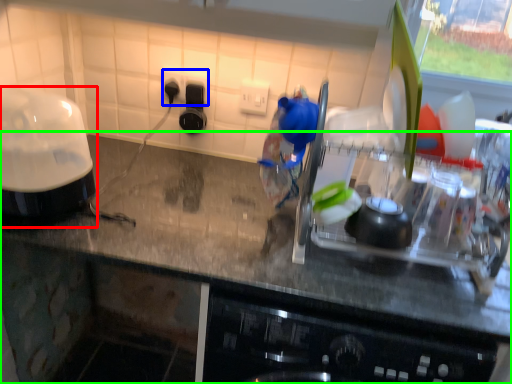
Question: Based on their relative distances, which object is farther from home appliance (highlighted by a red box)? Choose from electric outlet (highlighted by a blue box) and countertop (highlighted by a green box).

Choices:
 (A) electric outlet
 (B) countertop

Answer: (A)